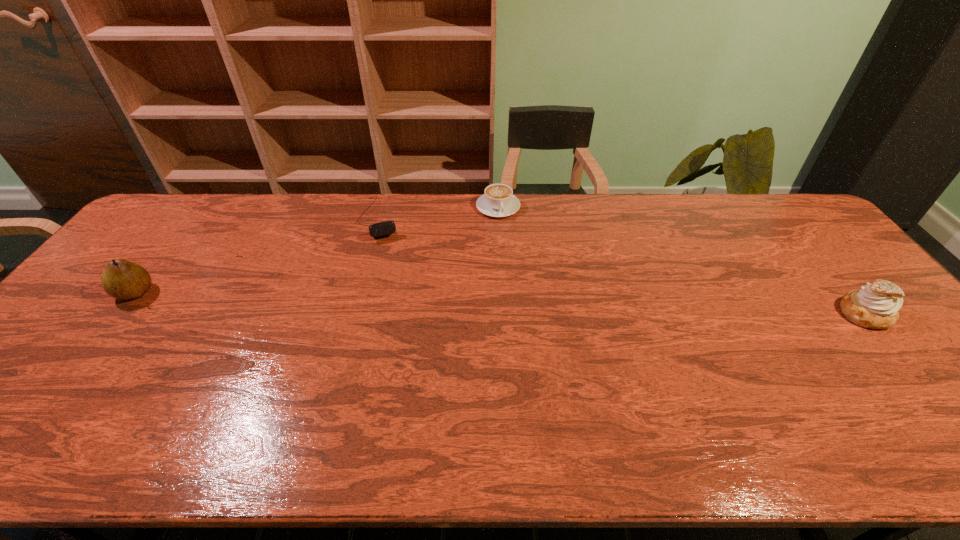
The image size is (960, 540). I want to click on the tallest object, so click(x=121, y=279).

At what (x,y) coordinates should I click in order to perform the action: click on pear. Please return your answer as a coordinate pair (x, y). This screenshot has height=540, width=960. Looking at the image, I should click on (121, 279).

Image resolution: width=960 pixels, height=540 pixels. In order to click on pastry in this screenshot , I will do `click(875, 306)`.

The height and width of the screenshot is (540, 960). I want to click on the third shortest object, so click(875, 306).

You are a GUI agent. You are given a task and a screenshot of the screen. Output one action in this format:
    pyautogui.click(x=<x>, y=<y>)
    Task: Click on the cappuccino
    
    Given the screenshot: What is the action you would take?
    pyautogui.click(x=498, y=200)

Where is `webcam`? The image size is (960, 540). webcam is located at coordinates (386, 228).

You are a GUI agent. You are given a task and a screenshot of the screen. Output one action in this format:
    pyautogui.click(x=<x>, y=<y>)
    Task: Click on the vacant space located on the front of the pear
    This screenshot has height=540, width=960.
    Given the screenshot: What is the action you would take?
    pyautogui.click(x=65, y=383)

Locate an element on the screen. The width and height of the screenshot is (960, 540). vacant space located 0.080m on the back of the second tallest object is located at coordinates (834, 277).

Locate an element on the screen. free space located on the side of the cappuccino with the handle is located at coordinates (511, 243).

Locate an element on the screen. This screenshot has width=960, height=540. vacant space positioned on the side of the cappuccino with the handle is located at coordinates (513, 251).